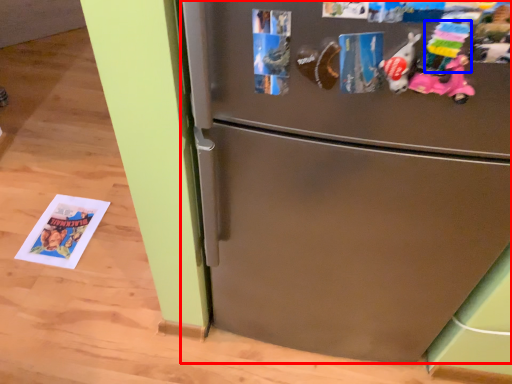
Question: Which point is closer to the camera, refrigerator (highlighted by a red box) or toy (highlighted by a blue box)?

Choices:
 (A) refrigerator
 (B) toy

Answer: (B)